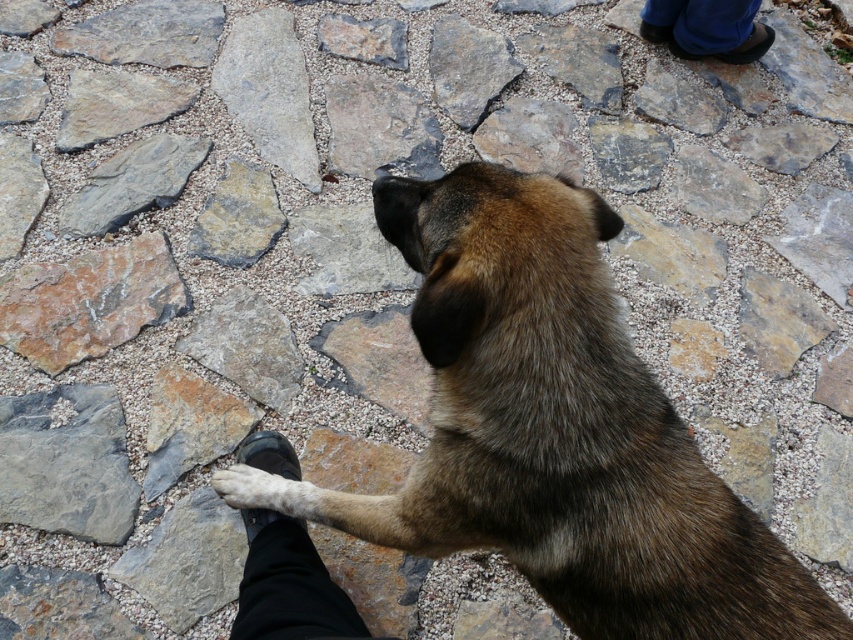
Consider the image. You are a dog owner who wants to place a treat between the rusty stone at upper left and the gray rough stone at upper left. Since the rusty stone is closer to you, where should you aim to place the treat so it ends up between them?

Place the treat closer to the rusty stone at upper left since it is nearer to you, ensuring the treat is between the two stones.

You are a photographer standing at the edge of the stone pavement. You want to take a photo of the brown furry dog at center and the blue denim pants at upper right. Which object should you focus on first to ensure both are in clear view?

The brown furry dog at center is closer to the viewer than the blue denim pants at upper right. To ensure both are in clear view, focus on the brown furry dog at center first, as it is closer, and the pants will be in the background but still within the depth of field.

The brown furry dog at center is standing on a stone paved surface. Which coordinate point is the dog located at?

The brown furry dog at center is located at coordinate point (554, 429).